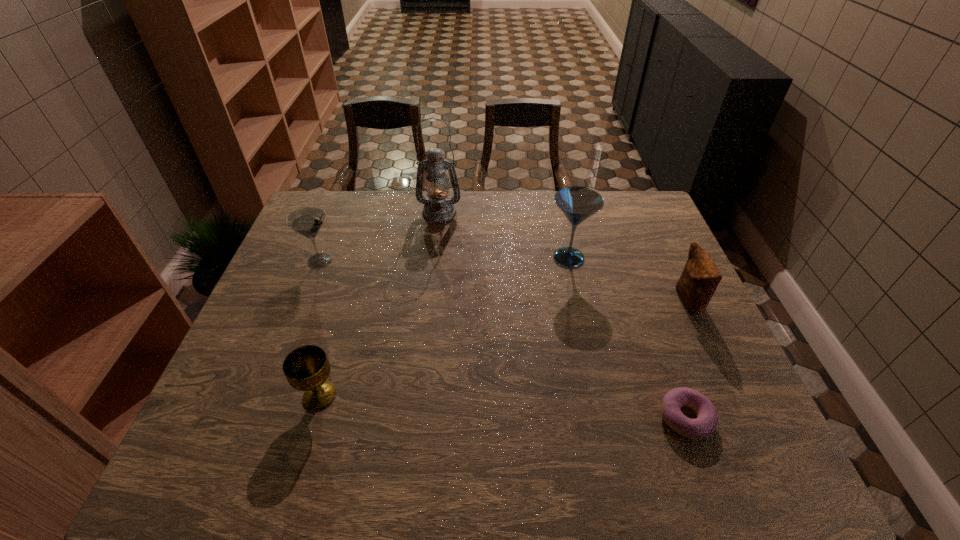
Where is `free space between the third object from right to left and the chalice`? The width and height of the screenshot is (960, 540). free space between the third object from right to left and the chalice is located at coordinates (444, 327).

Locate an element on the screen. vacant point located between the left martini and the oil lamp is located at coordinates (380, 237).

Locate an element on the screen. The height and width of the screenshot is (540, 960). free space between the shortest object and the fourth tallest object is located at coordinates (686, 360).

Image resolution: width=960 pixels, height=540 pixels. Identify the location of free space between the rightmost object and the shorter martini. (504, 281).

The width and height of the screenshot is (960, 540). In order to click on vacant region between the oil lamp and the leftmost object in this screenshot , I will do `click(380, 237)`.

Locate an element on the screen. This screenshot has width=960, height=540. free spot between the fifth object from right to left and the right martini is located at coordinates (444, 327).

At what (x,y) coordinates should I click in order to perform the action: click on vacant area between the leftmost object and the third object from left to right. Please return your answer as a coordinate pair (x, y). Looking at the image, I should click on (380, 237).

The width and height of the screenshot is (960, 540). I want to click on empty space that is in between the fifth object from right to left and the shortest object, so click(502, 407).

Locate an element on the screen. free spot between the fourth object from left to right and the fifth object from right to left is located at coordinates (444, 327).

Identify the location of unoccupied position between the fifth tallest object and the clutch bag. (504, 348).